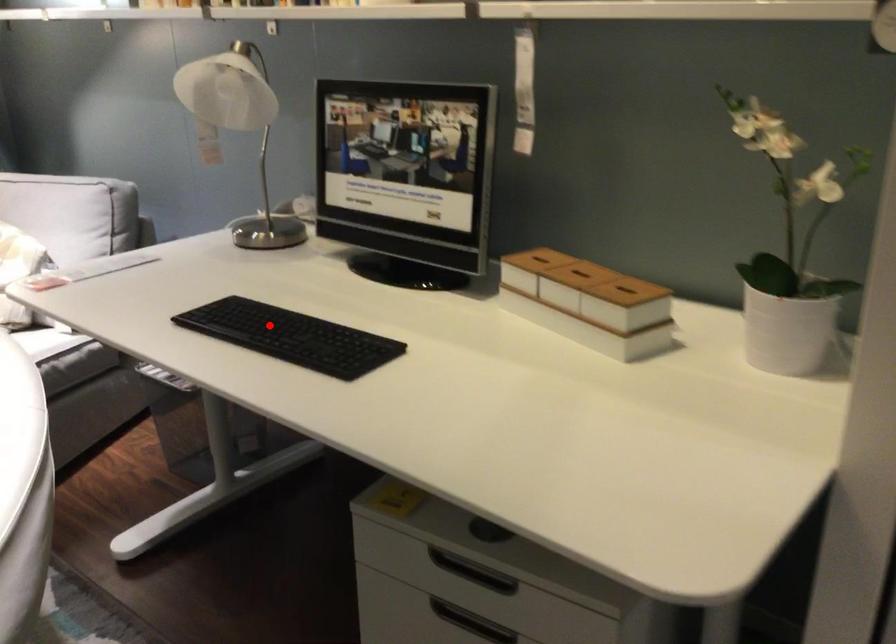
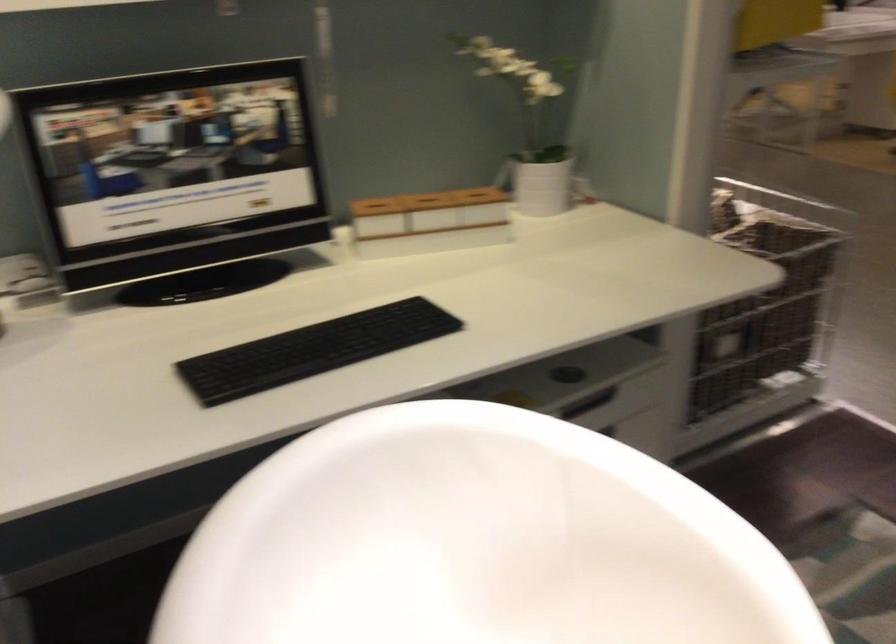
Question: I am providing you with two images of the same scene from different viewpoints. In image1, a red point is highlighted. Considering the same 3D point in image2, which of the following is correct?

Choices:
 (A) It is closer
 (B) It is farther

Answer: (A)